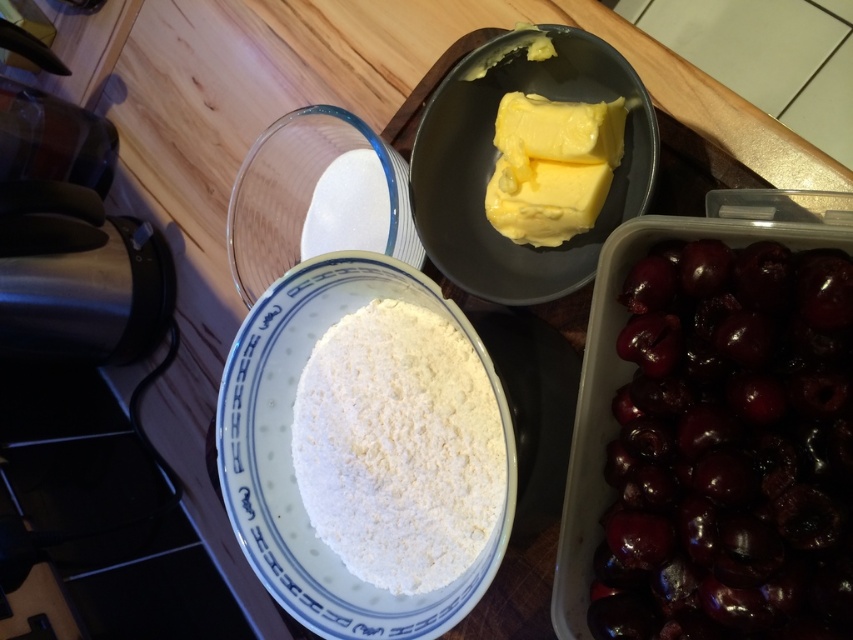
You are a chef preparing a recipe that requires both the shiny dark red cherries at bottom right and the yellowish matte butter at upper center. The recipe specifies that the ingredients must be within 6 inches of each other to maintain freshness. Based on the image, can you confirm if they are close enough?

The distance between the shiny dark red cherries at bottom right and the yellowish matte butter at upper center is 6.47 inches, which is slightly more than the required 6 inches. Therefore, they are not close enough to meet the recipe specifications.

You are a baker preparing a recipe that requires equal portions of both types of butter. You have the yellowish matte butter at upper center and the yellow creamy butter at upper center. Can you divide them into equal portions without wasting any butter?

The yellowish matte butter at upper center is larger in size than the yellow creamy butter at upper center, so you cannot divide them into equal portions without wasting the excess butter from the larger one.